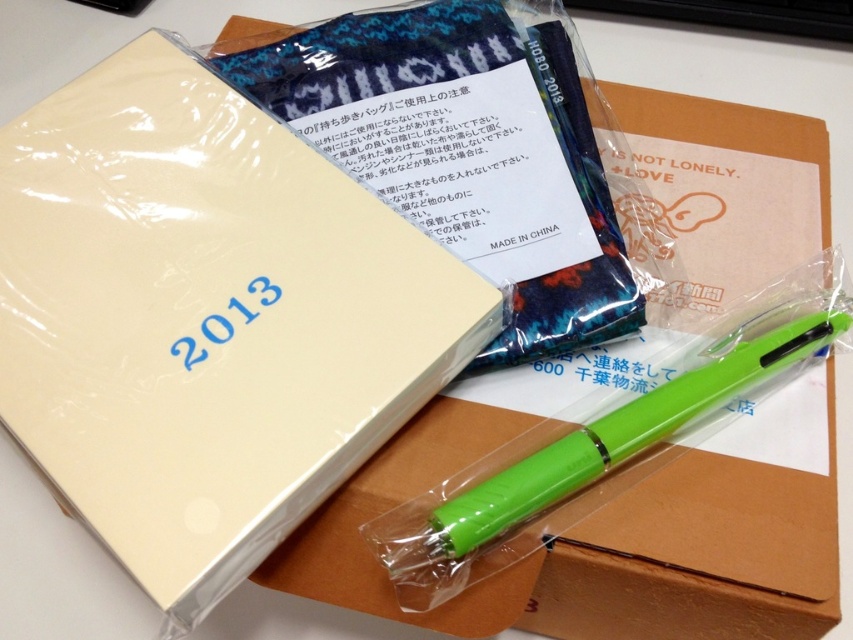
Question: Can you confirm if matte cream notepad at upper left is bigger than matte brown cardboard box at center?

Choices:
 (A) yes
 (B) no

Answer: (B)

Question: Can you confirm if matte cream notepad at upper left is positioned to the left of green plastic pen at lower right?

Choices:
 (A) no
 (B) yes

Answer: (B)

Question: Among these points, which one is nearest to the camera?

Choices:
 (A) (749, 352)
 (B) (18, 118)
 (C) (746, 275)

Answer: (A)

Question: Which object is the closest to the matte brown cardboard box at center?

Choices:
 (A) matte cream notepad at upper left
 (B) green plastic pen at lower right

Answer: (B)

Question: Can you confirm if matte cream notepad at upper left is positioned above green plastic pen at lower right?

Choices:
 (A) no
 (B) yes

Answer: (B)

Question: Which point is closer to the camera taking this photo?

Choices:
 (A) (437, 534)
 (B) (322, 364)

Answer: (A)